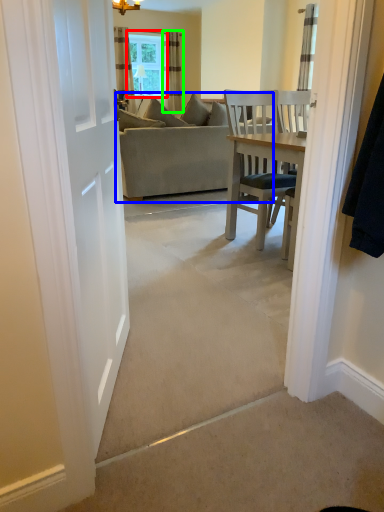
Question: Considering the real-world distances, which object is farthest from window (highlighted by a red box)? studio couch (highlighted by a blue box) or curtain (highlighted by a green box)?

Choices:
 (A) studio couch
 (B) curtain

Answer: (A)